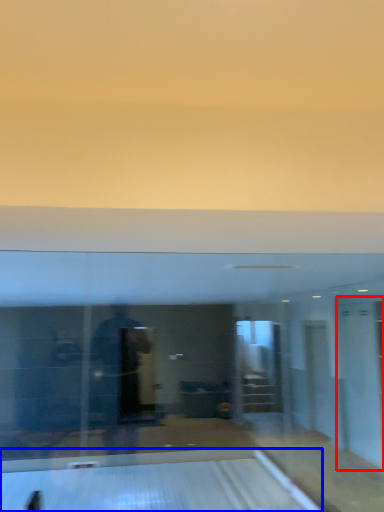
Question: Which object appears farthest to the camera in this image, glass door (highlighted by a red box) or bowling alley (highlighted by a blue box)?

Choices:
 (A) glass door
 (B) bowling alley

Answer: (A)